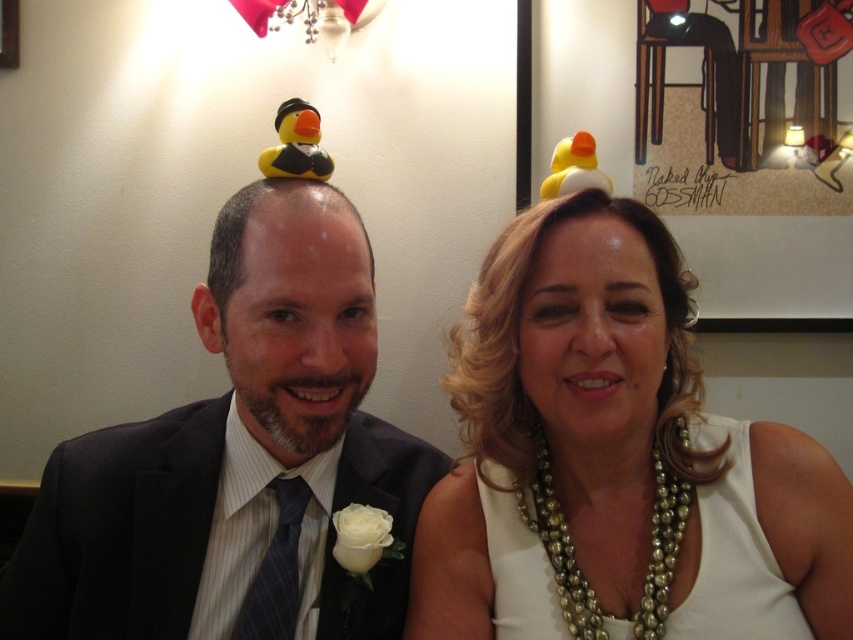
You are a photographer at a formal event. You need to decide which pearl necklace between the pearl necklace at upper center and the white pearl necklace at center would be more noticeable in a headshot due to its size. Which one should you focus on?

The pearl necklace at upper center is larger in width than the white pearl necklace at center, so it would be more noticeable in a headshot and should be the focus.

You are attending a formal event and notice the pearl necklace at upper center. Where exactly is the pearl necklace positioned in relation to the other elements in the scene?

The pearl necklace at upper center is located at point coordinates [614,460].